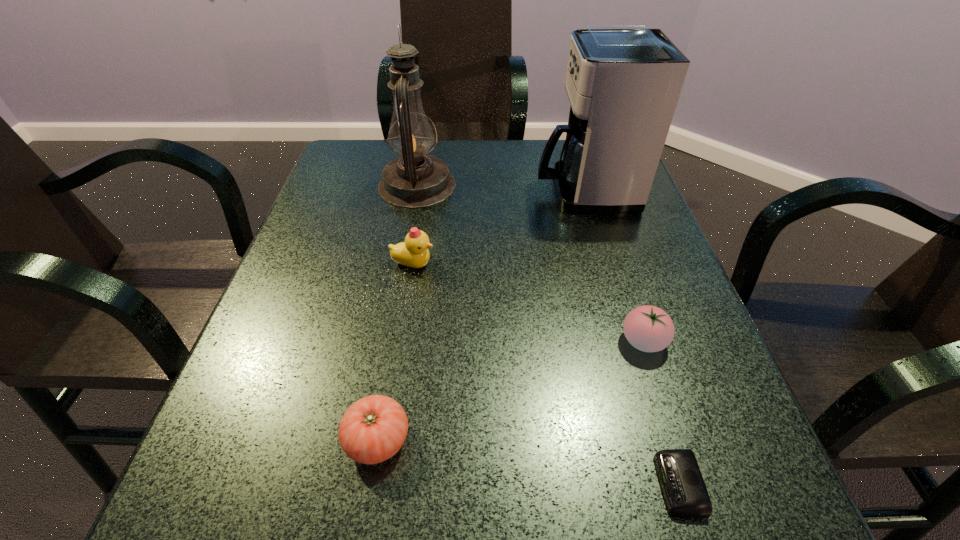
This screenshot has height=540, width=960. What are the coordinates of `oil lamp` in the screenshot? It's located at (416, 180).

What are the coordinates of `coffee maker` in the screenshot? It's located at (623, 82).

Find the location of a particular element. This screenshot has height=540, width=960. the fourth shortest object is located at coordinates (414, 252).

At what (x,y) coordinates should I click in order to perform the action: click on duckling. Please return your answer as a coordinate pair (x, y). Looking at the image, I should click on (414, 252).

Locate an element on the screen. Image resolution: width=960 pixels, height=540 pixels. the fourth farthest object is located at coordinates (648, 328).

This screenshot has width=960, height=540. Identify the location of the right tomato. (648, 328).

Where is `the nearer tomato`? The height and width of the screenshot is (540, 960). the nearer tomato is located at coordinates (373, 429).

Image resolution: width=960 pixels, height=540 pixels. In order to click on the shortest object in this screenshot , I will do `click(685, 493)`.

Locate an element on the screen. The image size is (960, 540). vacant region located 0.050m on the front of the oil lamp is located at coordinates (411, 222).

Locate an element on the screen. The image size is (960, 540). free point located 0.170m on the front panel of the coffee maker is located at coordinates (466, 191).